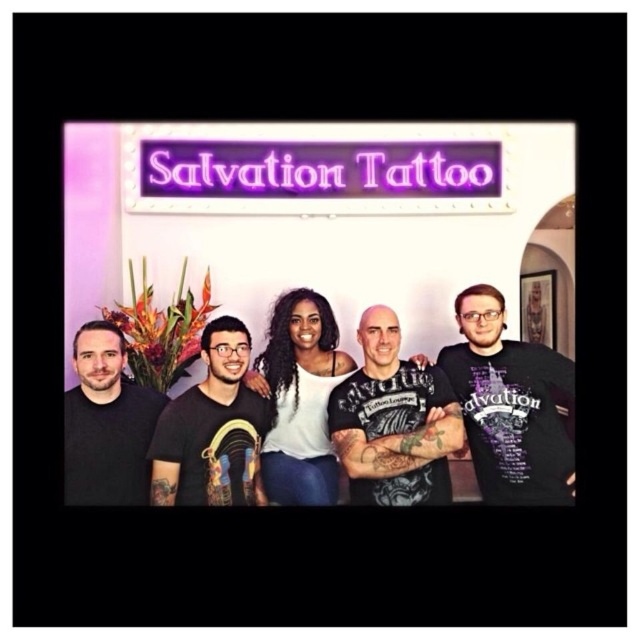
Between point (188, 456) and point (92, 355), which one is positioned in front?

Point (188, 456) is more forward.

In order to click on black matte t-shirt at center in this screenshot , I will do `click(212, 429)`.

Is black t-shirt at center positioned at the back of matte black t-shirt at left?

Yes, it is behind matte black t-shirt at left.

Between black t-shirt at center and matte black t-shirt at left, which one has more height?

black t-shirt at center is taller.

You are a GUI agent. You are given a task and a screenshot of the screen. Output one action in this format:
    pyautogui.click(x=<x>, y=<y>)
    Task: Click on the black t-shirt at center
    
    Given the screenshot: What is the action you would take?
    pyautogui.click(x=394, y=420)

Who is more forward, (x=376, y=387) or (x=296, y=326)?

Point (x=376, y=387)

Is point (346, 385) positioned after point (284, 492)?

Yes, it is.

Locate an element on the screen. The height and width of the screenshot is (640, 640). black t-shirt at center is located at coordinates (394, 420).